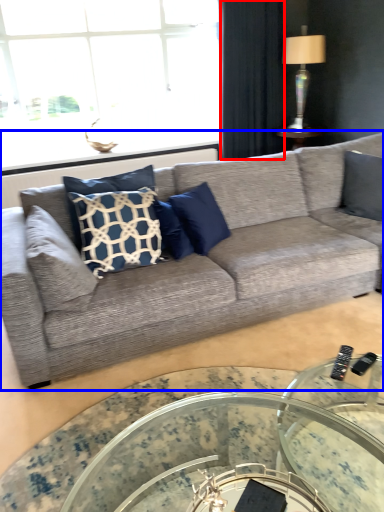
Question: Which of the following is the closest to the observer, curtain (highlighted by a red box) or studio couch (highlighted by a blue box)?

Choices:
 (A) curtain
 (B) studio couch

Answer: (B)